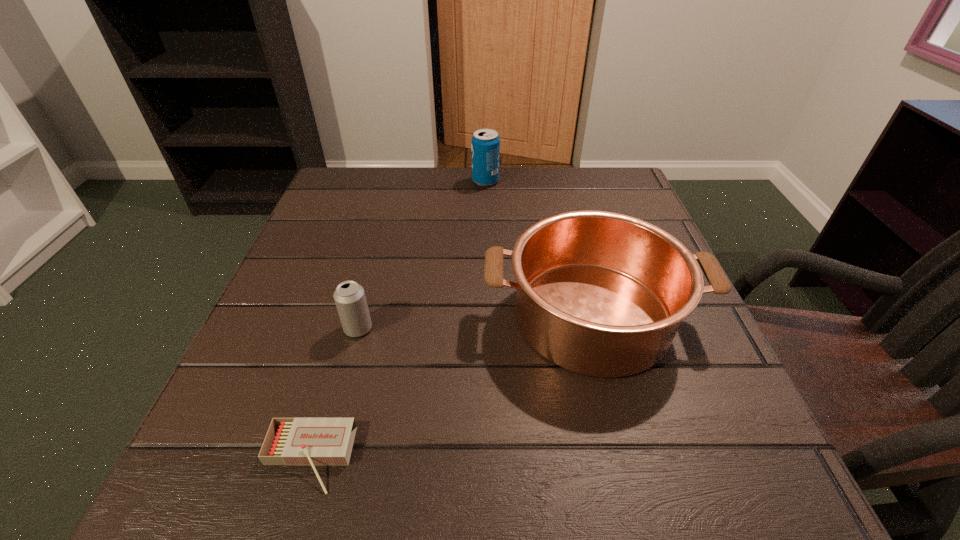
This screenshot has height=540, width=960. I want to click on soda can, so click(485, 142).

Locate an element on the screen. saucepan is located at coordinates (602, 294).

Find the location of `beer can`. beer can is located at coordinates (349, 296).

This screenshot has height=540, width=960. In order to click on the shortest object in this screenshot , I will do `click(289, 441)`.

Identify the location of matchbox. (289, 441).

You are a GUI agent. You are given a task and a screenshot of the screen. Output one action in this format:
    pyautogui.click(x=<x>, y=<y>)
    Task: Click on the vacant area situated 0.310m on the left of the farthest object
    This screenshot has height=540, width=960.
    Given the screenshot: What is the action you would take?
    pyautogui.click(x=353, y=181)

At what (x,y) coordinates should I click in order to perform the action: click on free space located on the back of the saucepan. Please return your answer as a coordinate pair (x, y). Looking at the image, I should click on (559, 185).

Identify the location of vacant space situated on the right of the second shortest object. (588, 328).

Find the location of a particular element. The height and width of the screenshot is (540, 960). object located in the far edge section of the desktop is located at coordinates (485, 142).

I want to click on object present at the near edge, so (289, 441).